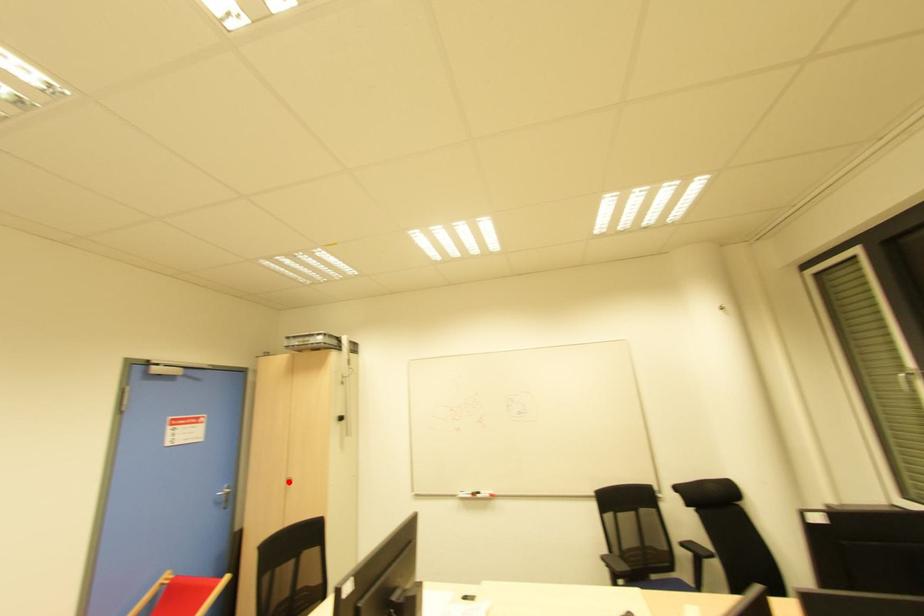
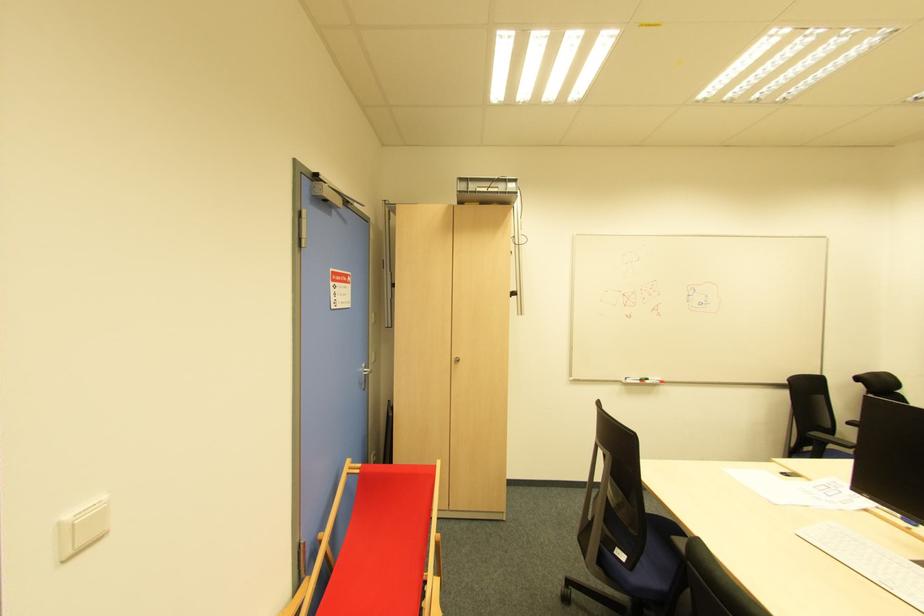
Where in the second image is the point corresponding to the highlighted location from the first image?

(457, 362)